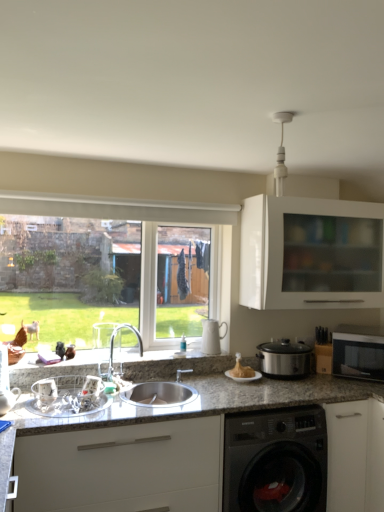
Question: From the image's perspective, is metallic silver dish rack at sink, the 3th appliance in the back-to-front sequence, above or below granite/stone countertop at lower center?

Choices:
 (A) below
 (B) above

Answer: (B)

Question: Considering the positions of metallic silver dish rack at sink, which is counted as the second appliance, starting from the left, and granite/stone countertop at lower center in the image, is metallic silver dish rack at sink, which is counted as the second appliance, starting from the left, taller or shorter than granite/stone countertop at lower center?

Choices:
 (A) short
 (B) tall

Answer: (A)

Question: Estimate the real-world distances between objects in this image. Which object is farther from the granite countertop at lower left, which ranks as the second cabinetry in top-to-bottom order?

Choices:
 (A) clear glass window at center
 (B) silver metallic faucet at center
 (C) metallic silver sink at lower left, the 1th appliance viewed from the left
 (D) white glossy cabinet at upper right, marked as the 1th cabinetry in a top-to-bottom arrangement
 (E) golden crispy turkey at center

Answer: (D)

Question: Considering the real-world distances, which object is closest to the white glossy cabinet at upper right, the first cabinetry in the right-to-left sequence?

Choices:
 (A) granite countertop at lower left, the second cabinetry viewed from the right
 (B) granite/stone countertop at lower center
 (C) metallic silver sink at lower left, the 1th appliance viewed from the left
 (D) metallic silver dish rack at sink, arranged as the second appliance when viewed from the right
 (E) silver metallic microwave at right

Answer: (E)